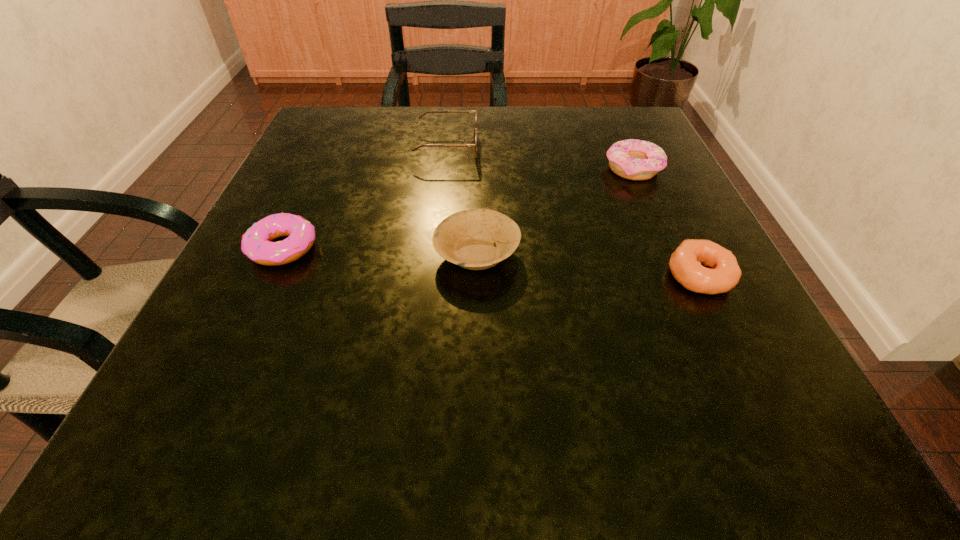
Locate an element on the screen. The width and height of the screenshot is (960, 540). spectacles is located at coordinates (475, 130).

What are the coordinates of `the farthest doughnut` in the screenshot? It's located at (632, 159).

Find the location of `bowl`. bowl is located at coordinates (466, 238).

You are a GUI agent. You are given a task and a screenshot of the screen. Output one action in this format:
    pyautogui.click(x=<x>, y=<y>)
    Task: Click on the leftmost object
    
    Given the screenshot: What is the action you would take?
    pyautogui.click(x=256, y=244)

Identify the location of free region located 0.290m at the front view of the tallest object. Image resolution: width=960 pixels, height=540 pixels. (617, 148).

Find the location of `free space located on the left of the farthest doughnut`. free space located on the left of the farthest doughnut is located at coordinates (543, 168).

Where is `blank space located 0.170m on the back of the bowl`? blank space located 0.170m on the back of the bowl is located at coordinates (477, 171).

This screenshot has height=540, width=960. I want to click on vacant space located on the right of the leftmost doughnut, so click(x=425, y=248).

Identify the location of spectacles that is at the far edge. This screenshot has width=960, height=540. pyautogui.click(x=475, y=130).

You are a GUI agent. You are given a task and a screenshot of the screen. Output one action in this format:
    pyautogui.click(x=<x>, y=<y>)
    Task: Click on the doughnut located in the far edge section of the desktop
    Image resolution: width=960 pixels, height=540 pixels.
    Given the screenshot: What is the action you would take?
    [x=632, y=159]